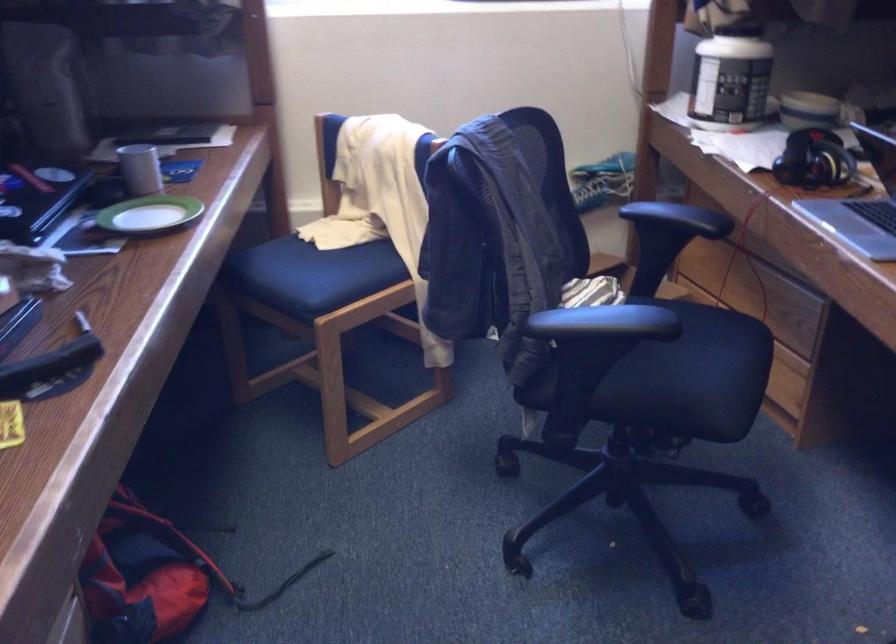
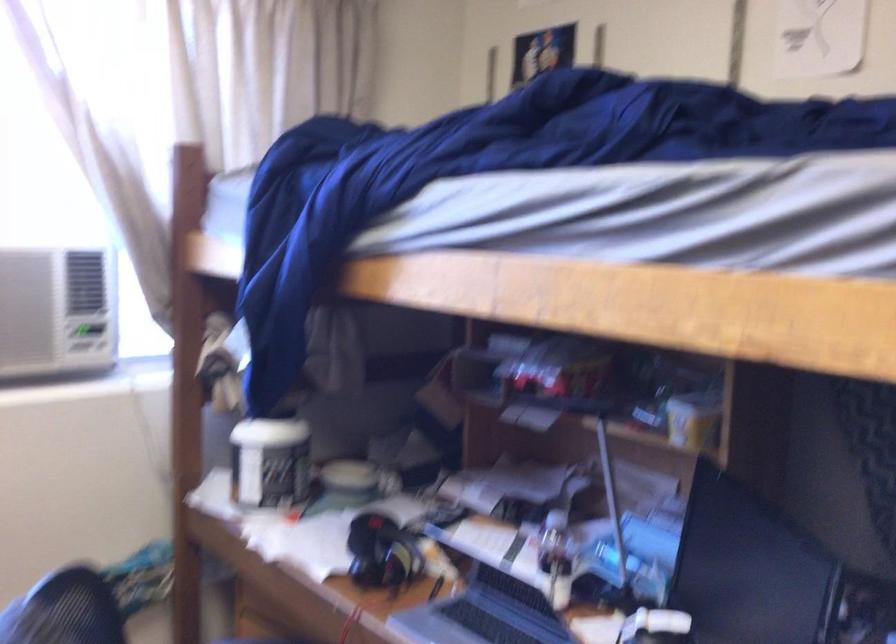
The images are taken continuously from a first-person perspective. In which direction is your viewpoint rotating?

The camera's rotation is toward right-up.